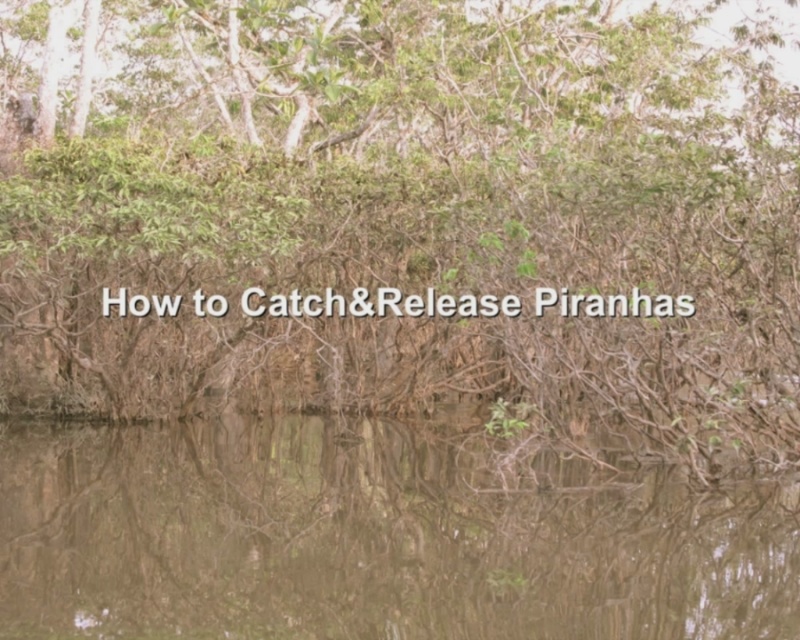
You are standing at the point marked by the coordinates point (408,218) in the scene. What is the nearest object to you?

The point (408,218) marks the green leafy tree at center, so the nearest object to you is the green leafy tree at center itself.

You are standing at the edge of the water in the image and want to know if the green leafy tree at center is wider than the brown murky water at center. Can you determine this based on the scene?

The green leafy tree at center has a larger width than the brown murky water at center, so yes, the green leafy tree at center is wider than the brown murky water at center.